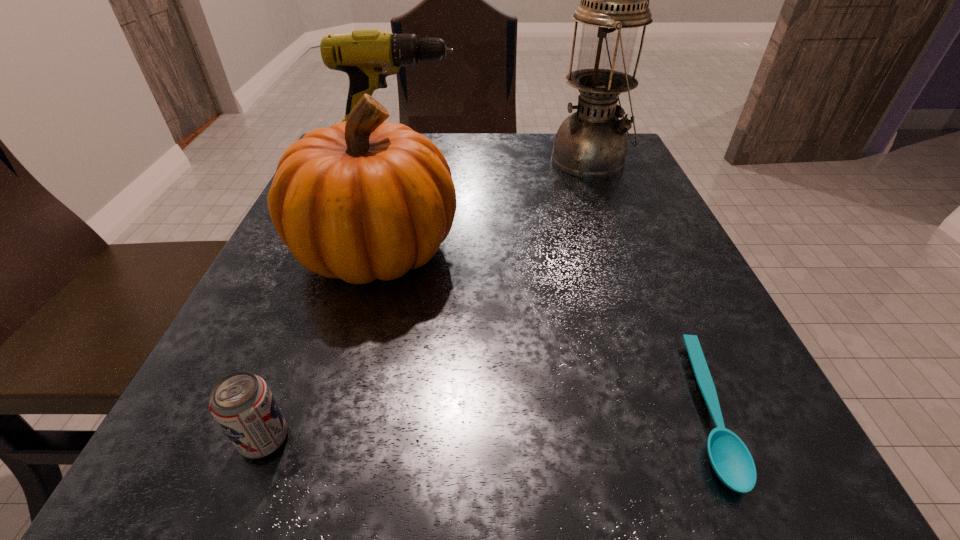
The image size is (960, 540). What are the coordinates of `oil lamp positioned at the far edge` in the screenshot? It's located at point(591,143).

At what (x,y) coordinates should I click in order to perform the action: click on drill that is positioned at the far edge. Please return your answer as a coordinate pair (x, y). Image resolution: width=960 pixels, height=540 pixels. Looking at the image, I should click on (368, 56).

Where is `beer can at the near edge`? This screenshot has height=540, width=960. beer can at the near edge is located at coordinates (242, 404).

The image size is (960, 540). Find the location of `spoon that is at the near edge`. spoon that is at the near edge is located at coordinates [731, 460].

Where is `drill at the left edge`? This screenshot has width=960, height=540. drill at the left edge is located at coordinates (368, 56).

Identify the location of pumpkin that is at the left edge. This screenshot has width=960, height=540. (362, 200).

You are a GUI agent. You are given a task and a screenshot of the screen. Output one action in this format:
    pyautogui.click(x=<x>, y=<y>)
    Task: Click on the beer can located in the left edge section of the desktop
    
    Given the screenshot: What is the action you would take?
    pyautogui.click(x=242, y=404)

Image resolution: width=960 pixels, height=540 pixels. What are the coordinates of `oil lamp at the right edge` in the screenshot? It's located at (591, 143).

This screenshot has width=960, height=540. Identify the location of spoon present at the right edge. (731, 460).

Find the location of a particular element. object that is at the far left corner is located at coordinates (368, 56).